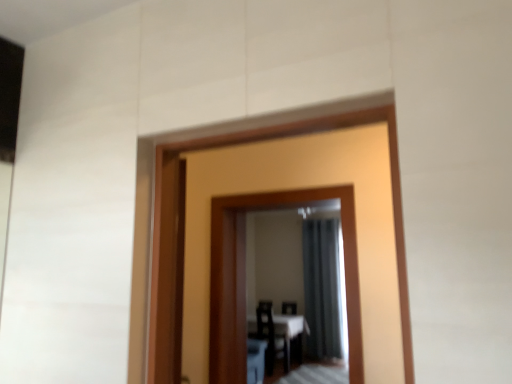
Question: Is dark gray fabric curtain at center not near black plastic chair at center?

Choices:
 (A) no
 (B) yes

Answer: (A)

Question: Can you confirm if dark gray fabric curtain at center is positioned to the right of black plastic chair at center?

Choices:
 (A) no
 (B) yes

Answer: (B)

Question: Does dark gray fabric curtain at center come in front of black plastic chair at center?

Choices:
 (A) yes
 (B) no

Answer: (A)

Question: Is black plastic chair at center inside dark gray fabric curtain at center?

Choices:
 (A) yes
 (B) no

Answer: (B)

Question: Is dark gray fabric curtain at center behind black plastic chair at center?

Choices:
 (A) yes
 (B) no

Answer: (B)

Question: Based on their sizes in the image, would you say wooden mirror at center is bigger or smaller than white glossy table at center?

Choices:
 (A) small
 (B) big

Answer: (A)

Question: Is point (350, 190) positioned closer to the camera than point (303, 327)?

Choices:
 (A) farther
 (B) closer

Answer: (B)

Question: Is wooden mirror at center in front of or behind white glossy table at center in the image?

Choices:
 (A) front
 (B) behind

Answer: (A)

Question: From the image's perspective, relative to white glossy table at center, is wooden mirror at center above or below?

Choices:
 (A) below
 (B) above

Answer: (B)

Question: Does point (289, 311) appear closer or farther from the camera than point (309, 188)?

Choices:
 (A) farther
 (B) closer

Answer: (A)

Question: From a real-world perspective, is black plastic chair at center physically located above or below wooden mirror at center?

Choices:
 (A) above
 (B) below

Answer: (B)

Question: In the image, is black plastic chair at center on the left side or the right side of wooden mirror at center?

Choices:
 (A) left
 (B) right

Answer: (B)

Question: From the image's perspective, is black plastic chair at center above or below wooden mirror at center?

Choices:
 (A) below
 (B) above

Answer: (A)

Question: From the image's perspective, relative to white glossy table at center, is black plastic chair at center above or below?

Choices:
 (A) below
 (B) above

Answer: (B)

Question: Considering the positions of black plastic chair at center and white glossy table at center in the image, is black plastic chair at center taller or shorter than white glossy table at center?

Choices:
 (A) tall
 (B) short

Answer: (B)